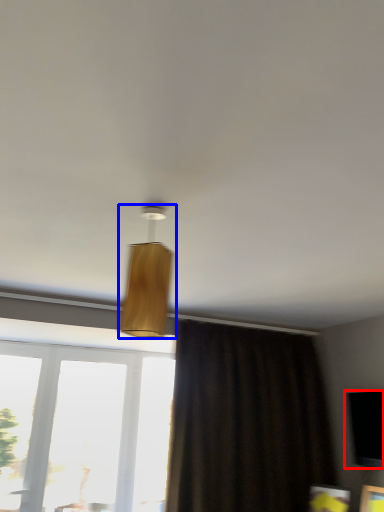
Question: Which object is further to the camera taking this photo, window screen (highlighted by a red box) or lamp (highlighted by a blue box)?

Choices:
 (A) window screen
 (B) lamp

Answer: (A)